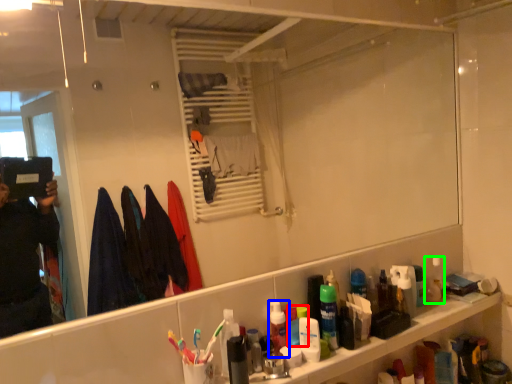
Question: Which is nearer to the mouthwash (highlighted by a red box)? mouthwash (highlighted by a blue box) or mouthwash (highlighted by a green box).

Choices:
 (A) mouthwash
 (B) mouthwash

Answer: (A)